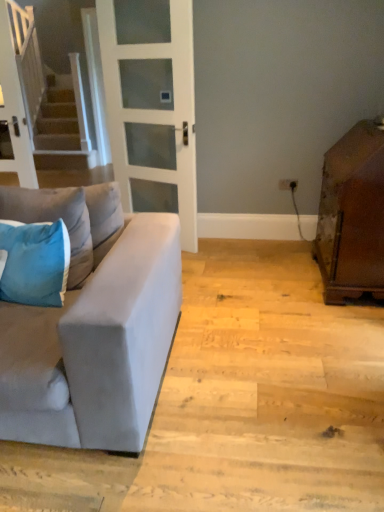
At what (x,y) coordinates should I click in order to perform the action: click on spots to the right of white frosted glass door at center. Please return your answer as a coordinate pair (x, y). The image size is (384, 512). Looking at the image, I should click on (219, 252).